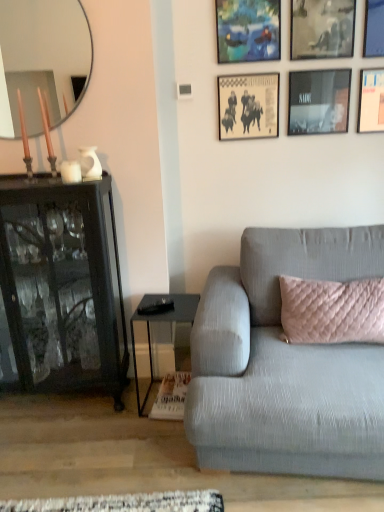
This screenshot has height=512, width=384. What are the coordinates of `free location in front of metallic glass table at lower center` in the screenshot? It's located at (150, 441).